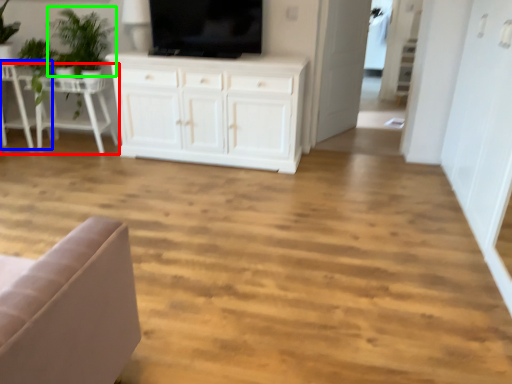
Question: Considering the real-world distances, which object is farthest from table (highlighted by a red box)? chair (highlighted by a blue box) or plant (highlighted by a green box)?

Choices:
 (A) chair
 (B) plant

Answer: (B)